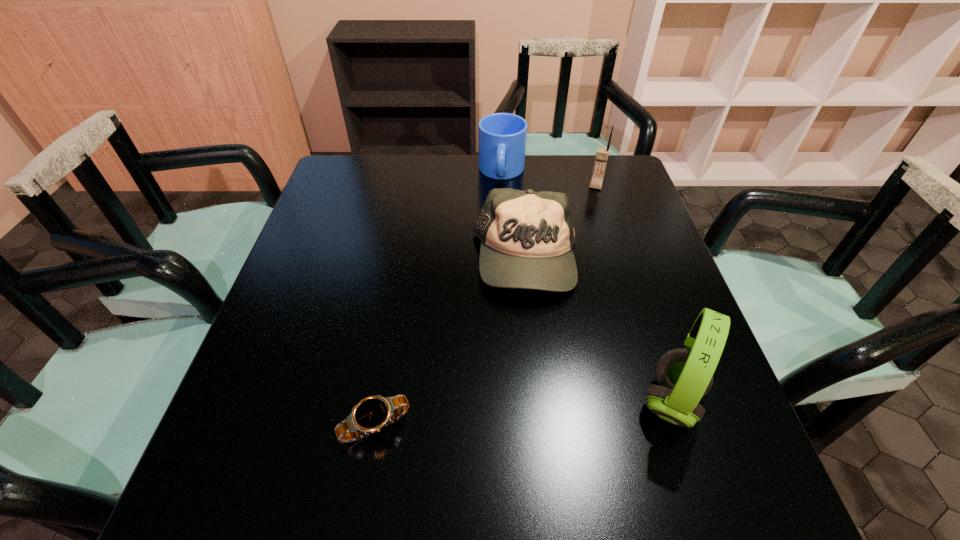
I want to click on vacant space on the desktop that is between the shortest object and the headset and is positioned on the front of the cellular telephone, where the keypad is located, so click(540, 412).

This screenshot has height=540, width=960. Find the location of `vacant space on the desktop that is between the watch and the headset and is positioned on the front-facing side of the baseball cap`. vacant space on the desktop that is between the watch and the headset and is positioned on the front-facing side of the baseball cap is located at coordinates (493, 415).

Image resolution: width=960 pixels, height=540 pixels. In order to click on vacant space on the desktop that is between the shortest object and the headset and is positioned on the side of the mug with the handle in this screenshot , I will do `click(491, 416)`.